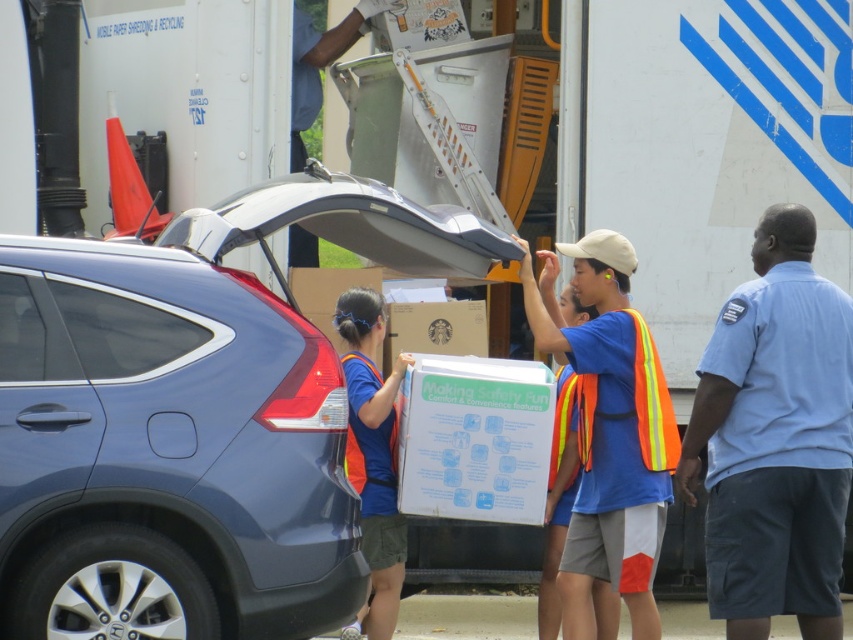
Question: Which point is closer to the camera taking this photo?

Choices:
 (A) pos(502,248)
 (B) pos(749,605)

Answer: (A)

Question: Does matte blue car at center-left have a larger size compared to light blue shirt at right?

Choices:
 (A) yes
 (B) no

Answer: (A)

Question: Which object is closer to the camera taking this photo?

Choices:
 (A) light blue shirt at right
 (B) matte blue car at center-left

Answer: (B)

Question: Observing the image, what is the correct spatial positioning of matte blue car at center-left in reference to light blue shirt at right?

Choices:
 (A) right
 (B) left

Answer: (B)

Question: Does matte blue car at center-left appear under light blue shirt at right?

Choices:
 (A) yes
 (B) no

Answer: (B)